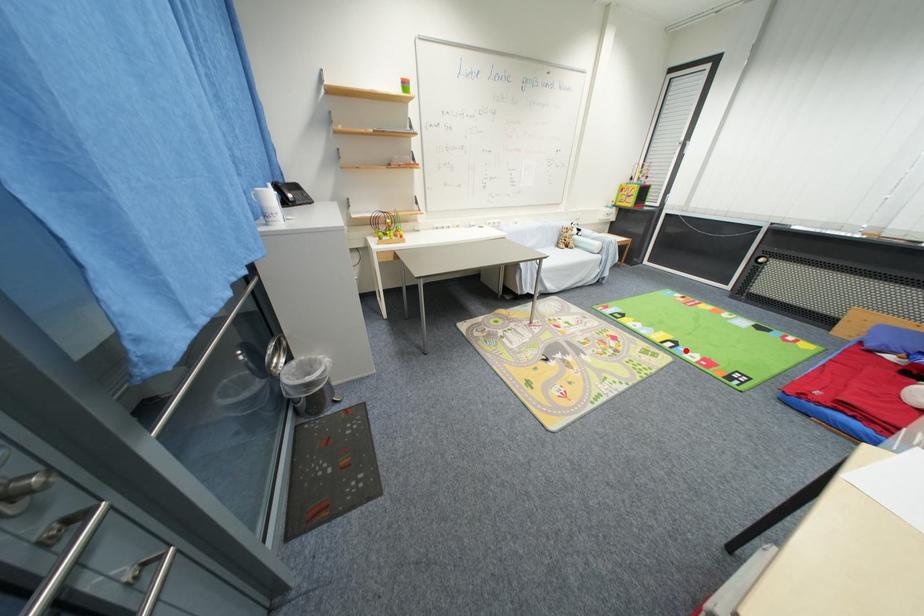
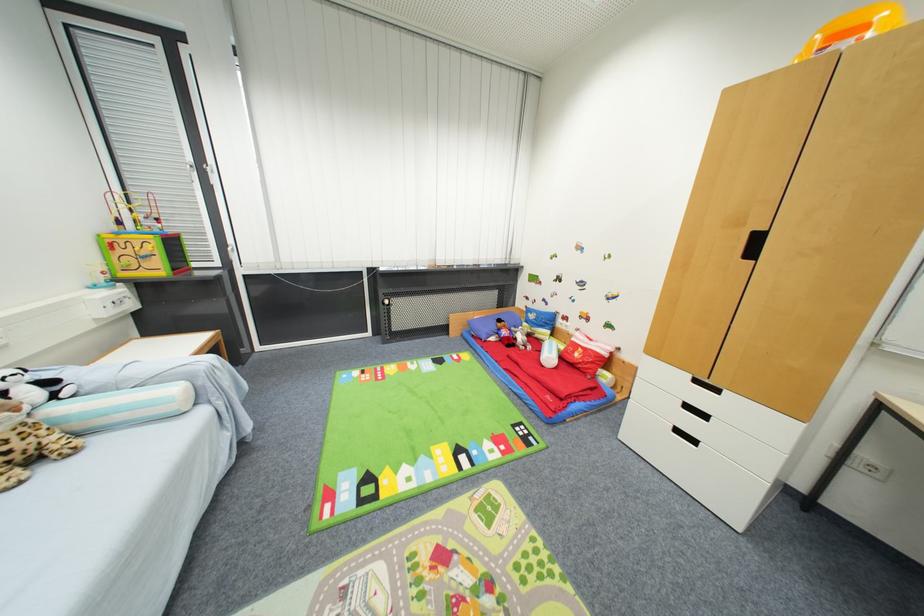
The point at the highlighted location is marked in the first image. Where is the corresponding point in the second image?

(479, 455)